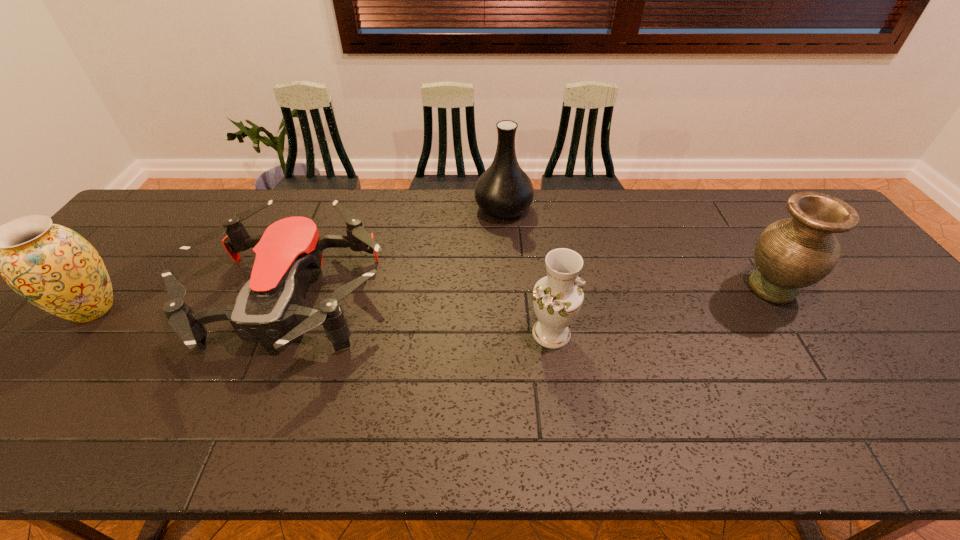
Where is `object that is at the left edge`? object that is at the left edge is located at coordinates (53, 267).

Where is `vacant space at the far edge of the desktop`? The width and height of the screenshot is (960, 540). vacant space at the far edge of the desktop is located at coordinates click(x=710, y=231).

Where is `vacant space at the right edge of the desktop`? The image size is (960, 540). vacant space at the right edge of the desktop is located at coordinates (854, 284).

Identify the location of vacant space at the far left corner. (189, 213).

Image resolution: width=960 pixels, height=540 pixels. Find the location of `free space between the drone and the farthest vase`. free space between the drone and the farthest vase is located at coordinates (397, 255).

I want to click on vacant space that is in between the farthest object and the fourth object from right to left, so click(x=397, y=255).

Where is `blank region between the rightmost vase and the leftmost vase`? This screenshot has height=540, width=960. blank region between the rightmost vase and the leftmost vase is located at coordinates (433, 299).

In order to click on vacant space in between the rightmost object and the leftmost vase in this screenshot , I will do `click(433, 299)`.

Identify which object is the closest to the rightmost vase. Please provide its 2D coordinates. Your answer should be formatted as a tuple, i.e. [(x, y)], where the tuple contains the x and y coordinates of a point satisfying the conditions above.

[(557, 298)]

At what (x,y) coordinates should I click in order to perform the action: click on object that can be found as the third closest to the farthest vase. Please return your answer as a coordinate pair (x, y). The height and width of the screenshot is (540, 960). Looking at the image, I should click on (792, 253).